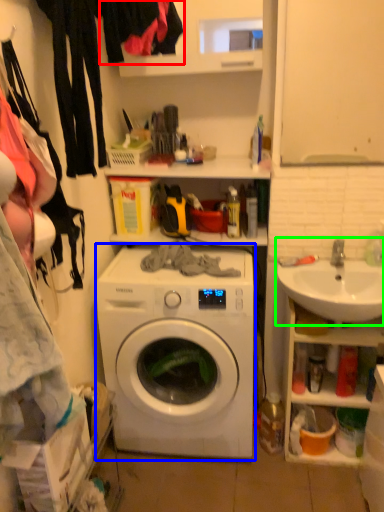
Question: Which is nearer to the clothing (highlighted by a red box)? washing machine (highlighted by a blue box) or sink (highlighted by a green box).

Choices:
 (A) washing machine
 (B) sink

Answer: (A)